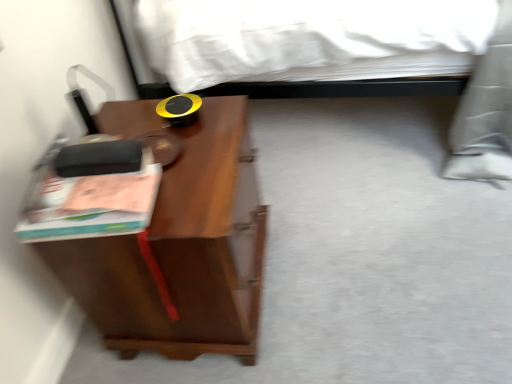
In the scene shown: In order to face matte pink paperback book at left, should I rotate leftwards or rightwards?

A: You should look left and rotate roughly 21.341 degrees.

The image size is (512, 384). Find the location of `matte pink paperback book at left`. matte pink paperback book at left is located at coordinates (92, 193).

The image size is (512, 384). Describe the element at coordinates (92, 193) in the screenshot. I see `matte pink paperback book at left` at that location.

Where is `brown wood nightstand at left`? This screenshot has width=512, height=384. brown wood nightstand at left is located at coordinates (179, 243).

What do you see at coordinates (179, 243) in the screenshot? I see `brown wood nightstand at left` at bounding box center [179, 243].

You are a GUI agent. You are given a task and a screenshot of the screen. Output one action in this format:
    pyautogui.click(x=<x>, y=<y>)
    Task: Click on the matte pink paperback book at left
    
    Given the screenshot: What is the action you would take?
    pyautogui.click(x=92, y=193)

Considering the positions of objects brown wood nightstand at left and matte pink paperback book at left in the image provided, who is more to the right, brown wood nightstand at left or matte pink paperback book at left?

brown wood nightstand at left.

Does brown wood nightstand at left come behind matte pink paperback book at left?

Yes, it is.

Which is behind, point (238, 228) or point (133, 232)?

Positioned behind is point (238, 228).

From the image's perspective, which one is positioned higher, brown wood nightstand at left or matte pink paperback book at left?

matte pink paperback book at left.

From a real-world perspective, which object stands above the other?

matte pink paperback book at left, from a real-world perspective.

Considering the sizes of objects brown wood nightstand at left and matte pink paperback book at left in the image provided, who is thinner, brown wood nightstand at left or matte pink paperback book at left?

With smaller width is matte pink paperback book at left.

From their relative heights in the image, would you say brown wood nightstand at left is taller or shorter than matte pink paperback book at left?

Clearly, brown wood nightstand at left is taller compared to matte pink paperback book at left.

Is brown wood nightstand at left bigger than matte pink paperback book at left?

Yes.

Choose the correct answer: Is brown wood nightstand at left inside matte pink paperback book at left or outside it?

brown wood nightstand at left lies outside matte pink paperback book at left.

Is there a large distance between brown wood nightstand at left and matte pink paperback book at left?

No, brown wood nightstand at left is not far away from matte pink paperback book at left.

Is brown wood nightstand at left turned away from matte pink paperback book at left?

No, brown wood nightstand at left's orientation is not away from matte pink paperback book at left.

What's the angular difference between brown wood nightstand at left and matte pink paperback book at left's facing directions?

The angular difference between brown wood nightstand at left and matte pink paperback book at left is 5.81 degrees.

You are a GUI agent. You are given a task and a screenshot of the screen. Output one action in this format:
    pyautogui.click(x=<x>, y=<y>)
    Task: Click on the paperback book above the brown wood nightstand at left (from a real-world perspective)
    
    Given the screenshot: What is the action you would take?
    pyautogui.click(x=92, y=193)

Is matte pink paperback book at left to the left of brown wood nightstand at left from the viewer's perspective?

Indeed, matte pink paperback book at left is positioned on the left side of brown wood nightstand at left.

Which is behind, matte pink paperback book at left or brown wood nightstand at left?

brown wood nightstand at left is behind.

Does point (88, 168) lie behind point (117, 252)?

No, (88, 168) is closer to viewer.

From the image's perspective, is matte pink paperback book at left on top of brown wood nightstand at left?

Yes, from the image's perspective, matte pink paperback book at left is above brown wood nightstand at left.

From a real-world perspective, who is located higher, matte pink paperback book at left or brown wood nightstand at left?

matte pink paperback book at left is physically above.

Which of these two, matte pink paperback book at left or brown wood nightstand at left, is thinner?

Thinner between the two is matte pink paperback book at left.

Which of these two, matte pink paperback book at left or brown wood nightstand at left, stands shorter?

Standing shorter between the two is matte pink paperback book at left.

Looking at this image, who is bigger, matte pink paperback book at left or brown wood nightstand at left?

brown wood nightstand at left.

Would you say matte pink paperback book at left is inside or outside brown wood nightstand at left?

matte pink paperback book at left cannot be found inside brown wood nightstand at left.

Can you see matte pink paperback book at left touching brown wood nightstand at left?

There is a gap between matte pink paperback book at left and brown wood nightstand at left.

Is matte pink paperback book at left looking in the opposite direction of brown wood nightstand at left?

matte pink paperback book at left does not have its back to brown wood nightstand at left.

The height and width of the screenshot is (384, 512). In the image, there is a brown wood nightstand at left. Identify the location of paperback book above it (from the image's perspective). (92, 193).

This screenshot has height=384, width=512. I want to click on paperback book that appears above the brown wood nightstand at left (from a real-world perspective), so click(x=92, y=193).

Image resolution: width=512 pixels, height=384 pixels. Identify the location of nightstand behind the matte pink paperback book at left. (179, 243).